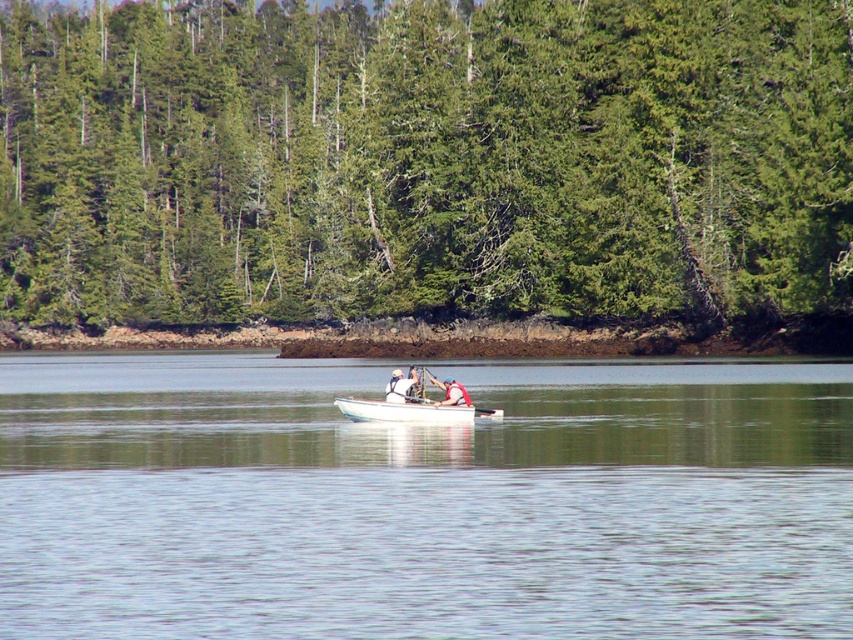
Between white fabric boat at center and wooden paddle at center, which one is positioned lower?

wooden paddle at center is below.

Measure the distance between white fabric boat at center and camera.

white fabric boat at center and camera are 101.77 feet apart.

The image size is (853, 640). Identify the location of white fabric boat at center. (422, 396).

At what (x,y) coordinates should I click in order to perform the action: click on clear water at center. Please return your answer as a coordinate pair (x, y). Looking at the image, I should click on (422, 500).

Who is positioned more to the left, clear water at center or wooden paddle at center?

Positioned to the left is clear water at center.

This screenshot has height=640, width=853. What are the coordinates of `clear water at center` in the screenshot? It's located at (422, 500).

The width and height of the screenshot is (853, 640). What are the coordinates of `clear water at center` in the screenshot? It's located at (422, 500).

Which is behind, point (422, 413) or point (450, 378)?

The point (450, 378) is more distant.

This screenshot has width=853, height=640. I want to click on white matte boat at center, so click(x=412, y=412).